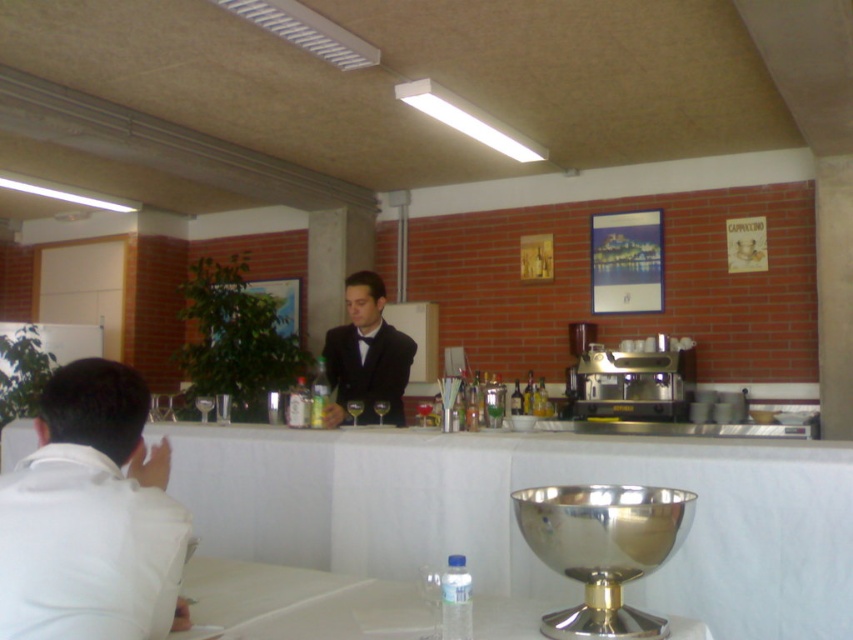
You are a customer at the bar and want to hand your credit card to the barista. The white fabric table at center is between you and the barista. Can you reach the barista from your current position at the white matte shirt at left without moving around the table?

The distance between the white fabric table at center and the white matte shirt at left is 5.27 feet. Since the table is between you and the barista, you would need to either lean over the table or move around it to reach the barista. However, since the question specifies not moving around the table, you cannot reach the barista directly from your current position at the white matte shirt at left without moving around the table.

Based on the coordinates provided, what object is located at point (x=514, y=518) in the image?

The point (x=514, y=518) corresponds to the white fabric table at center.